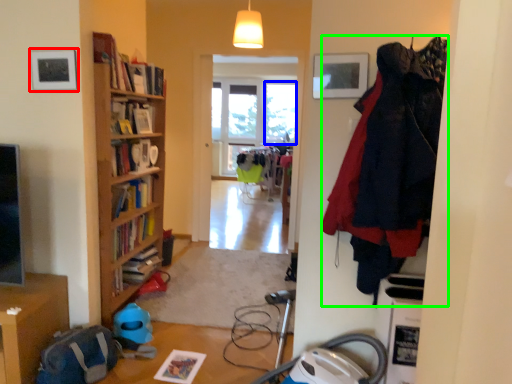
Question: Estimate the real-world distances between objects in this image. Which object is farther from picture frame (highlighted by a red box), window (highlighted by a blue box) or clothing (highlighted by a green box)?

Choices:
 (A) window
 (B) clothing

Answer: (A)